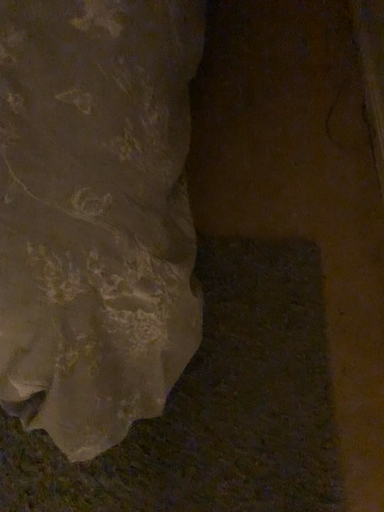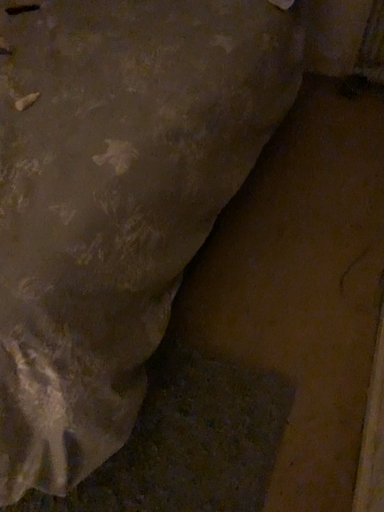
Question: Which way did the camera rotate in the video?

Choices:
 (A) rotated left
 (B) rotated right

Answer: (A)